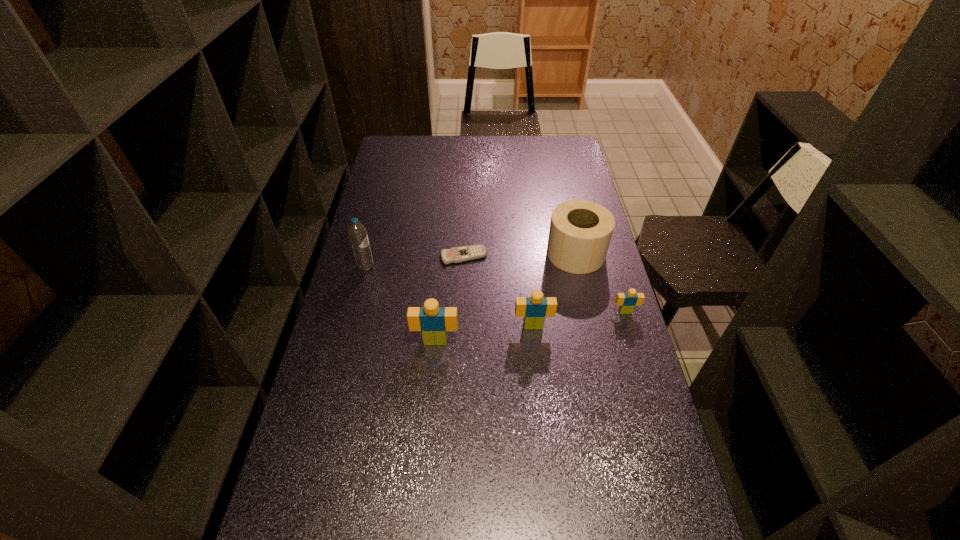
Locate an element on the screen. The height and width of the screenshot is (540, 960). vacant area that lies between the remote control and the second Lego from right to left is located at coordinates (498, 291).

Find the location of a particular element. vacant point located between the shortest object and the nearest object is located at coordinates (449, 299).

Image resolution: width=960 pixels, height=540 pixels. I want to click on empty space that is in between the toilet tissue and the second shortest Lego, so click(x=555, y=289).

Choose which object is the nearest neighbor to the shortest object. Please provide its 2D coordinates. Your answer should be formatted as a tuple, i.e. [(x, y)], where the tuple contains the x and y coordinates of a point satisfying the conditions above.

[(580, 232)]

Identify which object is located as the nearest to the leftmost object. Please provide its 2D coordinates. Your answer should be formatted as a tuple, i.e. [(x, y)], where the tuple contains the x and y coordinates of a point satisfying the conditions above.

[(454, 255)]

At what (x,y) coordinates should I click in order to perform the action: click on the second closest Lego relative to the tallest object. Please return your answer as a coordinate pair (x, y). This screenshot has width=960, height=540. Looking at the image, I should click on (534, 309).

You are a GUI agent. You are given a task and a screenshot of the screen. Output one action in this format:
    pyautogui.click(x=<x>, y=<y>)
    Task: Click on the Lego that stands as the third closest to the remote control
    
    Given the screenshot: What is the action you would take?
    pyautogui.click(x=627, y=301)